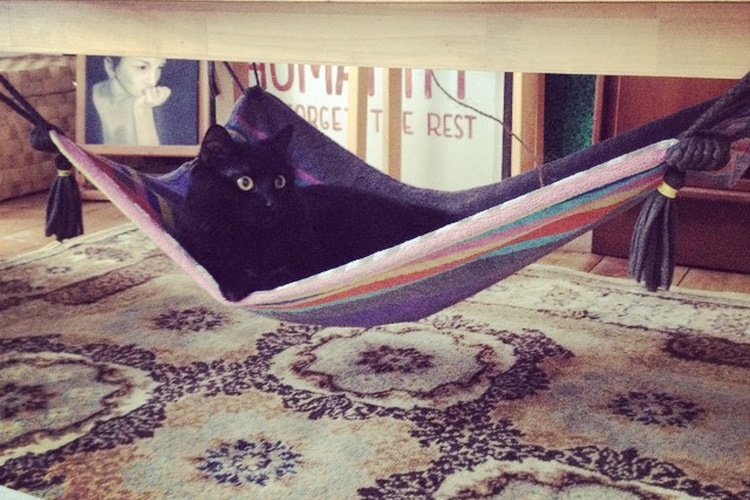
Find the location of `brick wall`. brick wall is located at coordinates (13, 154).